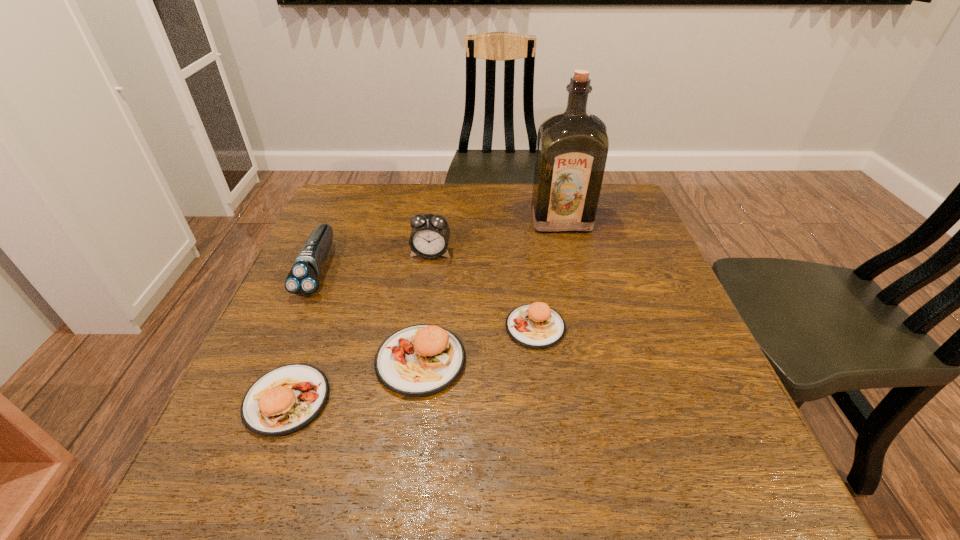
Where is `vacant space located 0.140m on the back of the shortest object`? This screenshot has height=540, width=960. vacant space located 0.140m on the back of the shortest object is located at coordinates (527, 266).

What are the coordinates of `free space located 0.230m on the head of the electric shaver` in the screenshot? It's located at (266, 390).

Image resolution: width=960 pixels, height=540 pixels. I want to click on vacant space located 0.110m on the front side of the alarm clock, so click(425, 292).

Identify the location of free region located on the label of the tallest object. (573, 268).

This screenshot has height=540, width=960. What are the coordinates of `object that is at the far edge` in the screenshot? It's located at (572, 147).

The width and height of the screenshot is (960, 540). Find the location of `patty at the left edge`. patty at the left edge is located at coordinates (286, 399).

Image resolution: width=960 pixels, height=540 pixels. I want to click on electric shaver at the left edge, so click(303, 279).

Locate an element on the screen. The width and height of the screenshot is (960, 540). object located in the right edge section of the desktop is located at coordinates (572, 147).

Identify the location of object that is at the near left corner. (286, 399).

Where is `object that is positioned at the far right corner`? object that is positioned at the far right corner is located at coordinates (572, 147).